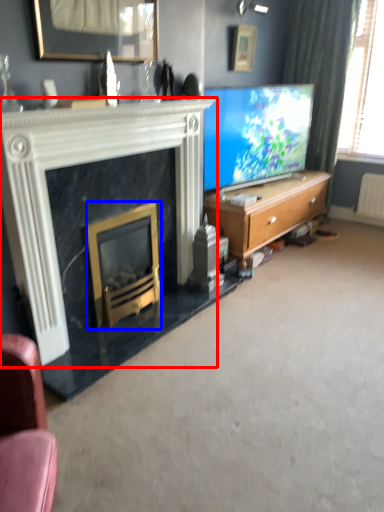
Question: Among these objects, which one is farthest to the camera, fireplace (highlighted by a red box) or fireplace (highlighted by a blue box)?

Choices:
 (A) fireplace
 (B) fireplace

Answer: (B)